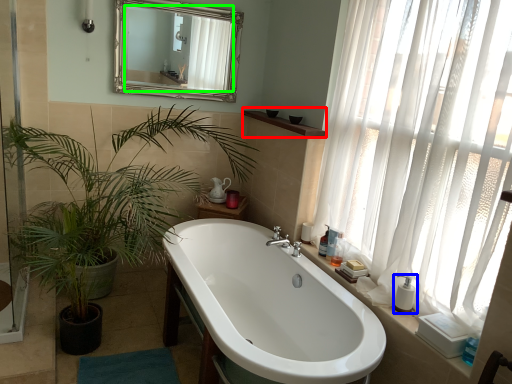
Question: Which is nearer to the window sill (highlighted by a red box)? soap dispenser (highlighted by a blue box) or mirror (highlighted by a green box).

Choices:
 (A) soap dispenser
 (B) mirror

Answer: (B)